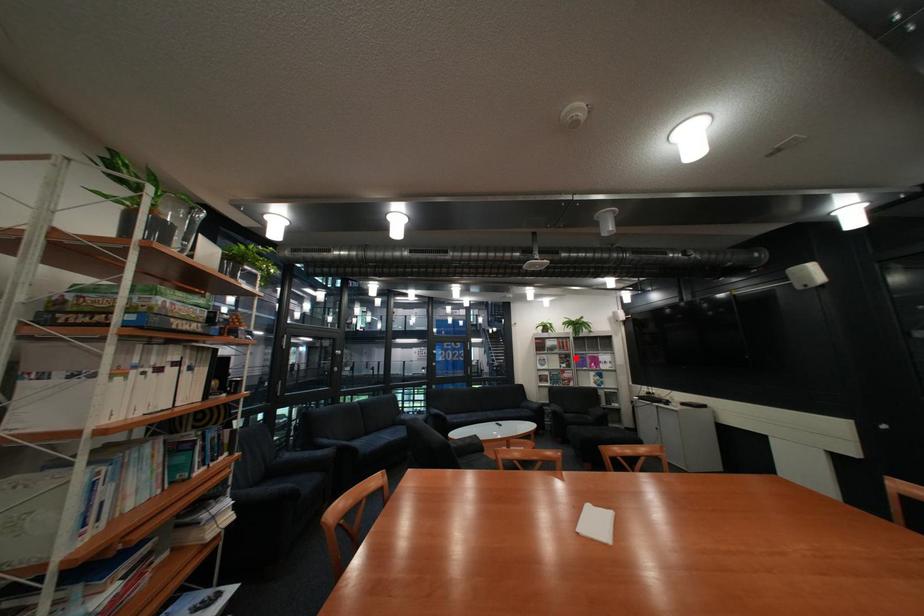
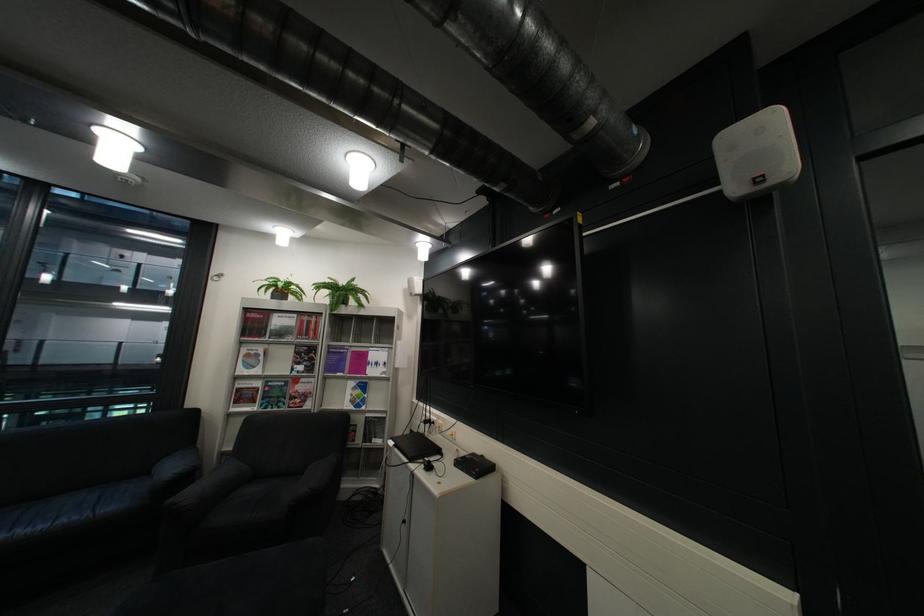
Where in the second image is the point corresponding to the highlighted location from the first image?

(311, 353)